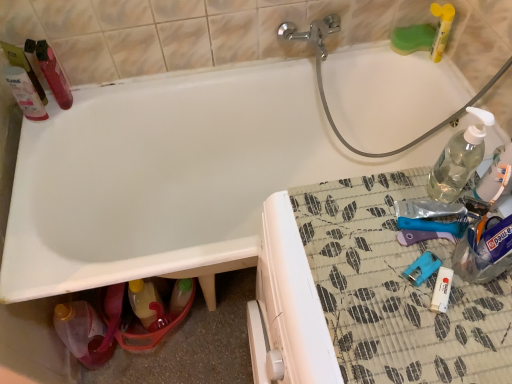
Question: From a real-world perspective, is translucent plastic bottle at upper left, arranged as the 5th bottle when ordered from the bottom, under translucent yellow bottle at lower left, which is the third bottle from left to right?

Choices:
 (A) yes
 (B) no

Answer: (B)

Question: From the image's perspective, is translucent plastic bottle at upper left, placed as the first bottle when sorted from left to right, under translucent yellow bottle at lower left, which is the 3th bottle from right to left?

Choices:
 (A) no
 (B) yes

Answer: (A)

Question: Considering the relative sizes of translucent plastic bottle at upper left, placed as the first bottle when sorted from left to right, and translucent yellow bottle at lower left, which is counted as the 2th bottle, starting from the bottom, in the image provided, is translucent plastic bottle at upper left, placed as the first bottle when sorted from left to right, thinner than translucent yellow bottle at lower left, which is counted as the 2th bottle, starting from the bottom,?

Choices:
 (A) no
 (B) yes

Answer: (B)

Question: Is translucent yellow bottle at lower left, the fourth bottle viewed from the top, a part of translucent plastic bottle at upper left, which is the 5th bottle from right to left?

Choices:
 (A) no
 (B) yes

Answer: (A)

Question: Considering the relative positions of translucent plastic bottle at upper left, arranged as the 1th bottle when viewed from the top, and translucent yellow bottle at lower left, the fourth bottle viewed from the top, in the image provided, is translucent plastic bottle at upper left, arranged as the 1th bottle when viewed from the top, to the left of translucent yellow bottle at lower left, the fourth bottle viewed from the top, from the viewer's perspective?

Choices:
 (A) no
 (B) yes

Answer: (B)

Question: In the image, is translucent plastic bottle at upper left, which is the 5th bottle from right to left, positioned in front of or behind translucent yellow bottle at lower left, which is counted as the 2th bottle, starting from the bottom?

Choices:
 (A) front
 (B) behind

Answer: (A)

Question: Considering the positions of point (59, 79) and point (141, 288), is point (59, 79) closer or farther from the camera than point (141, 288)?

Choices:
 (A) closer
 (B) farther

Answer: (A)

Question: Considering the positions of translucent plastic bottle at upper left, placed as the first bottle when sorted from left to right, and translucent yellow bottle at lower left, which is the 3th bottle from right to left, in the image, is translucent plastic bottle at upper left, placed as the first bottle when sorted from left to right, bigger or smaller than translucent yellow bottle at lower left, which is the 3th bottle from right to left,?

Choices:
 (A) big
 (B) small

Answer: (B)

Question: From their relative heights in the image, would you say translucent plastic bottle at upper left, which is the 5th bottle from right to left, is taller or shorter than translucent yellow bottle at lower left, which is the 3th bottle from right to left?

Choices:
 (A) tall
 (B) short

Answer: (B)

Question: Is point (501, 177) positioned closer to the camera than point (152, 286)?

Choices:
 (A) closer
 (B) farther

Answer: (A)

Question: Considering their positions, is clear plastic bottle at upper right, which appears as the 1th bottle when viewed from the right, located in front of or behind translucent yellow bottle at lower left, which is counted as the 2th bottle, starting from the bottom?

Choices:
 (A) behind
 (B) front

Answer: (B)

Question: From a real-world perspective, is clear plastic bottle at upper right, positioned as the 5th bottle in left-to-right order, above or below translucent yellow bottle at lower left, which is the third bottle from left to right?

Choices:
 (A) below
 (B) above

Answer: (B)

Question: In terms of width, does clear plastic bottle at upper right, which appears as the 1th bottle when viewed from the right, look wider or thinner when compared to translucent yellow bottle at lower left, which is counted as the 2th bottle, starting from the bottom?

Choices:
 (A) thin
 (B) wide

Answer: (A)

Question: Is translucent yellow bottle at lower left, which is the 3th bottle from right to left, wider or thinner than clear plastic bottle at upper right, which appears as the 1th bottle when viewed from the right?

Choices:
 (A) wide
 (B) thin

Answer: (A)

Question: From the image's perspective, is translucent yellow bottle at lower left, which is the third bottle from left to right, above or below clear plastic bottle at upper right, which is counted as the third bottle, starting from the top?

Choices:
 (A) above
 (B) below

Answer: (B)